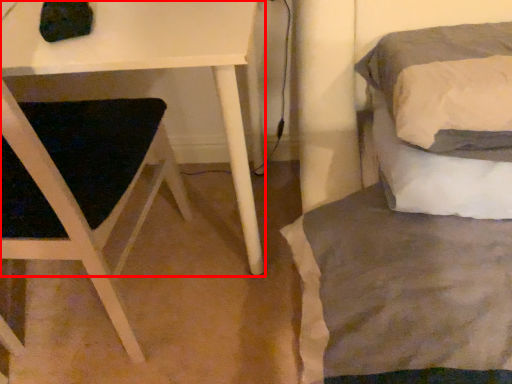
Question: Observing the image, what is the correct spatial positioning of table (annotated by the red box) in reference to bed?

Choices:
 (A) left
 (B) right

Answer: (A)